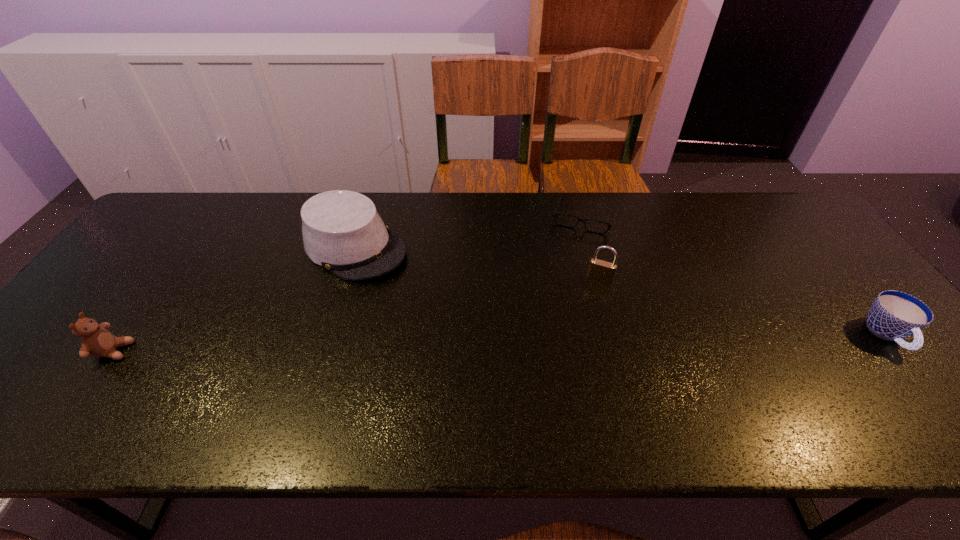
Where is `vacant space on the desktop that is between the leftmost object and the second shortest object and is positioned on the front-facing side of the padlock`? The height and width of the screenshot is (540, 960). vacant space on the desktop that is between the leftmost object and the second shortest object and is positioned on the front-facing side of the padlock is located at coordinates (579, 341).

You are a GUI agent. You are given a task and a screenshot of the screen. Output one action in this format:
    pyautogui.click(x=<x>, y=<y>)
    Task: Click on the vacant space on the desktop that is between the teddy bear and the cup and is positioned on the front-facing side of the fourth object from right to left
    This screenshot has width=960, height=540.
    Given the screenshot: What is the action you would take?
    pyautogui.click(x=502, y=343)

Locate an element on the screen. This screenshot has height=540, width=960. free space on the desktop that is between the leftmost object and the cup and is positioned on the front-facing side of the shortest object is located at coordinates (545, 342).